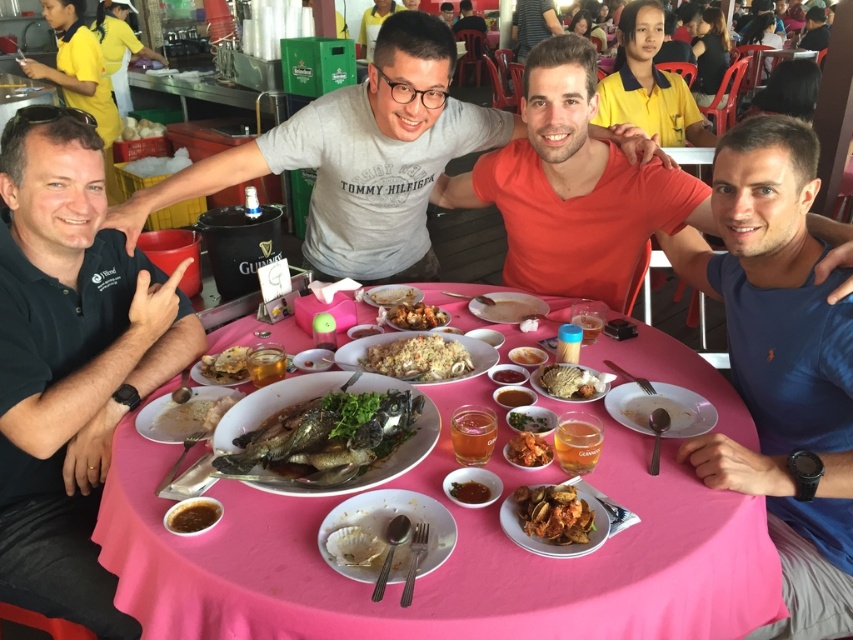
You are a photographer taking a picture of the orange matte shirt at center and the matte white plate at center on the table. Which object will appear larger in the photo?

The orange matte shirt at center will appear larger in the photo because it is bigger than the matte white plate at center according to the description.

You are a photographer taking a picture of the orange matte shirt at center and the matte white plate at center. Which object is covering the other one in the photo?

The orange matte shirt at center is positioned over matte white plate at center, so it is covering the plate in the photo.

You are a waiter at the restaurant and need to place a new order of bread on the table. The bread should be placed to the left of the pink plastic table at center. Where should you place the new bread in relation to the existing slightly browned bread at center?

The pink plastic table at center is positioned on the right side of slightly browned bread at center, so placing the new bread to the left of the pink plastic table at center would mean placing it to the left of the slightly browned bread at center.